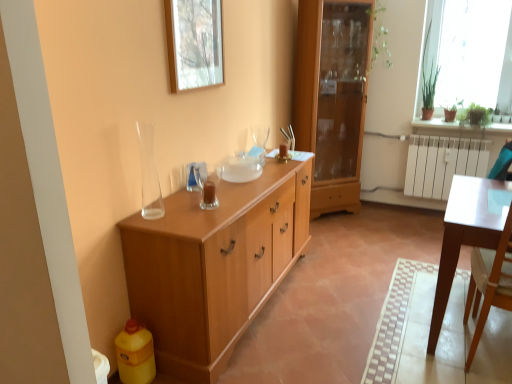
Image resolution: width=512 pixels, height=384 pixels. I want to click on free space in front of translucent glass candle at center, so click(x=208, y=209).